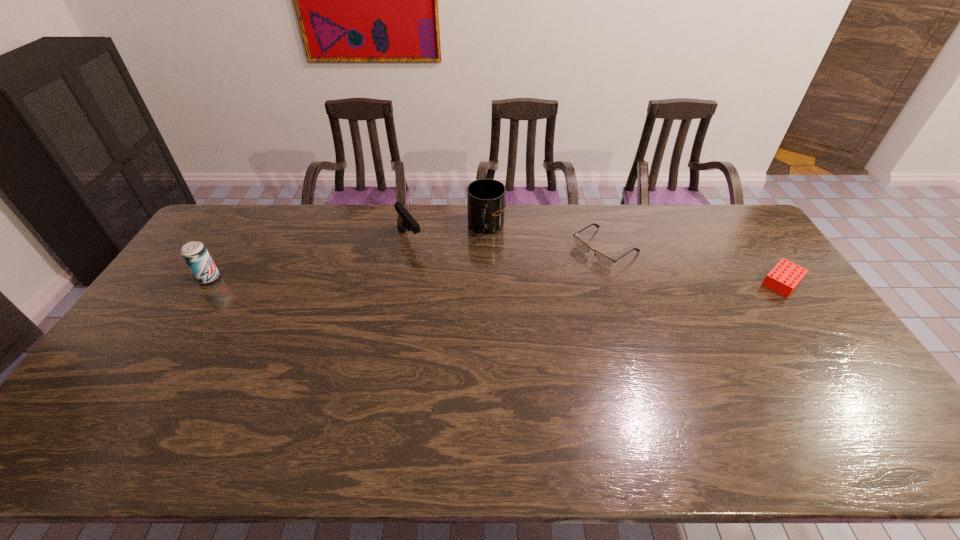
Identify the location of beer can. The width and height of the screenshot is (960, 540). (195, 254).

Locate an element on the screen. The width and height of the screenshot is (960, 540). Lego is located at coordinates (785, 276).

Locate an element on the screen. The image size is (960, 540). the fourth object from right to left is located at coordinates (405, 221).

This screenshot has height=540, width=960. Find the location of `pistol`. pistol is located at coordinates (405, 221).

The image size is (960, 540). Find the location of `the fourth object from left to right`. the fourth object from left to right is located at coordinates (579, 244).

Find the location of a particular element. The width and height of the screenshot is (960, 540). mug is located at coordinates (x=486, y=203).

The image size is (960, 540). In order to click on free space located 0.050m on the front of the beer can in this screenshot , I will do `click(197, 296)`.

At what (x,y) coordinates should I click in order to perform the action: click on vacant region located 0.270m on the back of the Lego. Please return your answer as a coordinate pair (x, y). This screenshot has width=960, height=540. Looking at the image, I should click on (737, 219).

The height and width of the screenshot is (540, 960). Identify the location of vacant point located 0.200m on the front-facing side of the pistol. (443, 286).

Where is `free region located on the front-facing side of the pistol`? free region located on the front-facing side of the pistol is located at coordinates (451, 298).